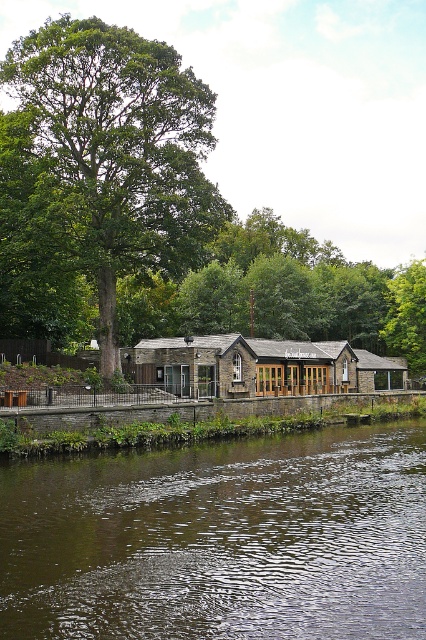
Question: Can you confirm if brown liquid water at lower center is positioned to the right of brown stone building at center?

Choices:
 (A) no
 (B) yes

Answer: (A)

Question: Which point is farther from the camera taking this photo?

Choices:
 (A) (192, 344)
 (B) (57, 552)
 (C) (52, 64)

Answer: (A)

Question: Among these objects, which one is nearest to the camera?

Choices:
 (A) brown liquid water at lower center
 (B) green leafy tree at upper right

Answer: (A)

Question: Which point appears closest to the camera in this image?

Choices:
 (A) (192, 106)
 (B) (77, 490)

Answer: (B)

Question: Does brown liquid water at lower center appear on the right side of green leafy tree at upper right?

Choices:
 (A) yes
 (B) no

Answer: (B)

Question: Is brown liquid water at lower center closer to camera compared to brown stone building at center?

Choices:
 (A) no
 (B) yes

Answer: (B)